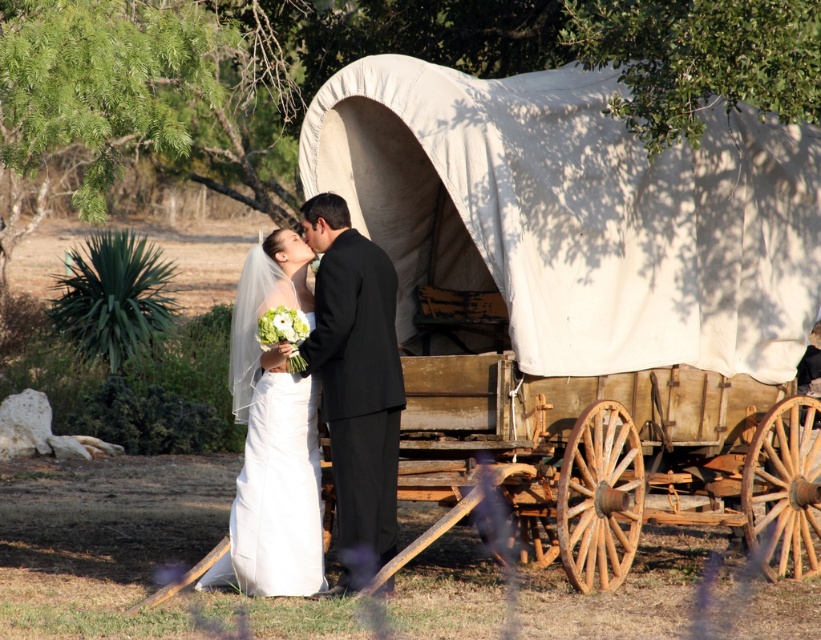
You are a photographer at the wedding and want to capture a photo of both the bride and groom and the covered wagon in the background. You are currently standing at point point (466, 289). The covered wagon is located at point (246, 570). Can you see the covered wagon from your current position?

Point (466, 289) is behind point (246, 570), so if you are standing at point (466, 289), you would be behind the covered wagon located at point (246, 570). Therefore, you cannot see the covered wagon from your current position.

You are a photographer at the wedding. You want to capture a photo that includes both the white canvas wagon at center and the white satin dress at center. Since the dress is smaller, where should you position the dress relative to the wagon to ensure it is still visible in the frame?

Since the white canvas wagon at center is larger in size than the white satin dress at center, positioning the white satin dress at center closer to the front or near the edge of the wagon will help ensure it remains visible in the photo.